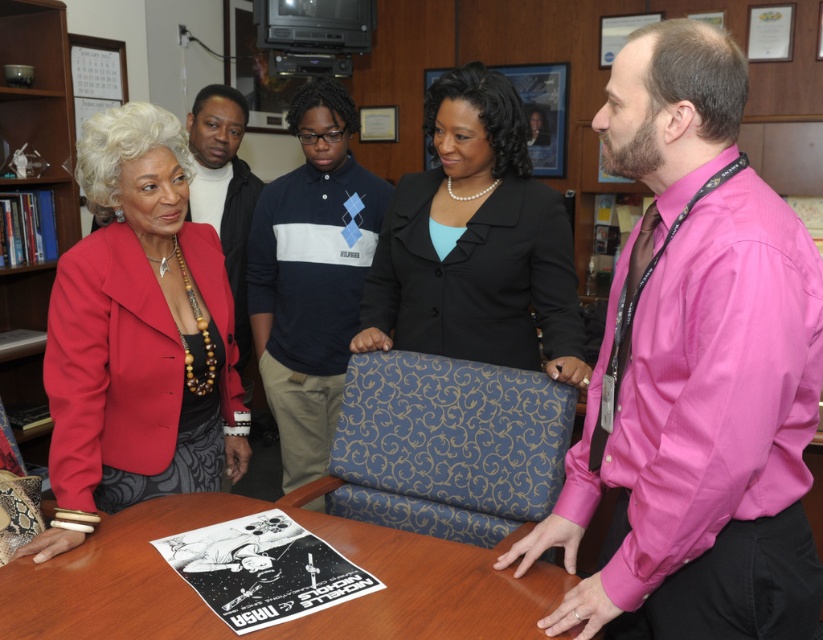
You are an office worker who needs to place a new document on the wooden table at center. To ensure it is visible from the wooden bookshelf at upper left, where should you place the document?

Place the document on the upper part of the wooden table at center since it is located below the wooden bookshelf at upper left, so positioning it higher up would make it more visible from above.

You are a person sitting at the wooden table at center. You want to place a small object exactly at the point labeled point (282,621). Is this point on the table?

Yes, the point labeled point (282,621) is on the wooden table at center, so you can place the object there.

In the scene shown: You are organizing a formal event and need to determine which of the two black garments, the black satin blazer at center or the black leather jacket at upper left, will require more space when hanging them in the closet. Based on their sizes, which one should you allocate more space to?

The black satin blazer at center is wider than the black leather jacket at upper left, so you should allocate more space to the black satin blazer at center when hanging them in the closet.